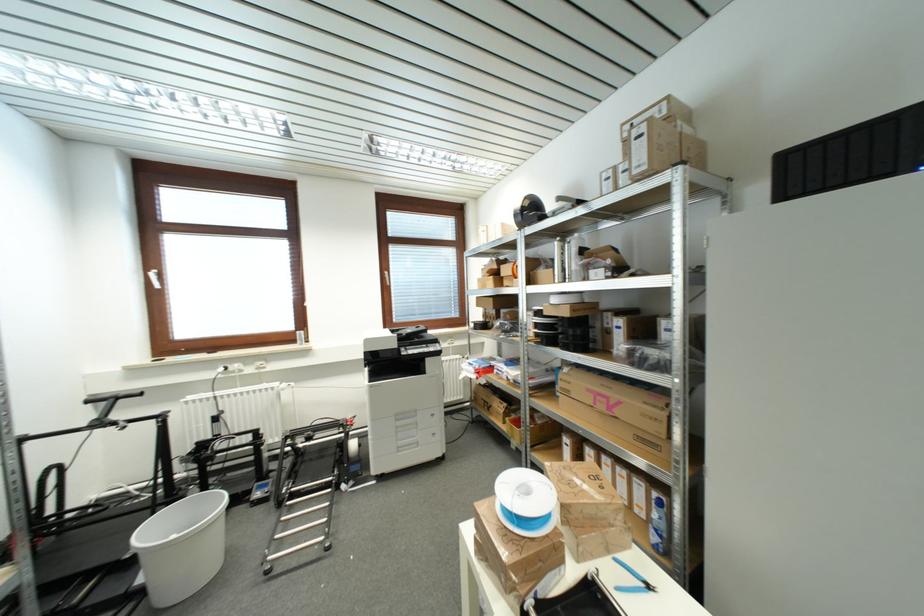
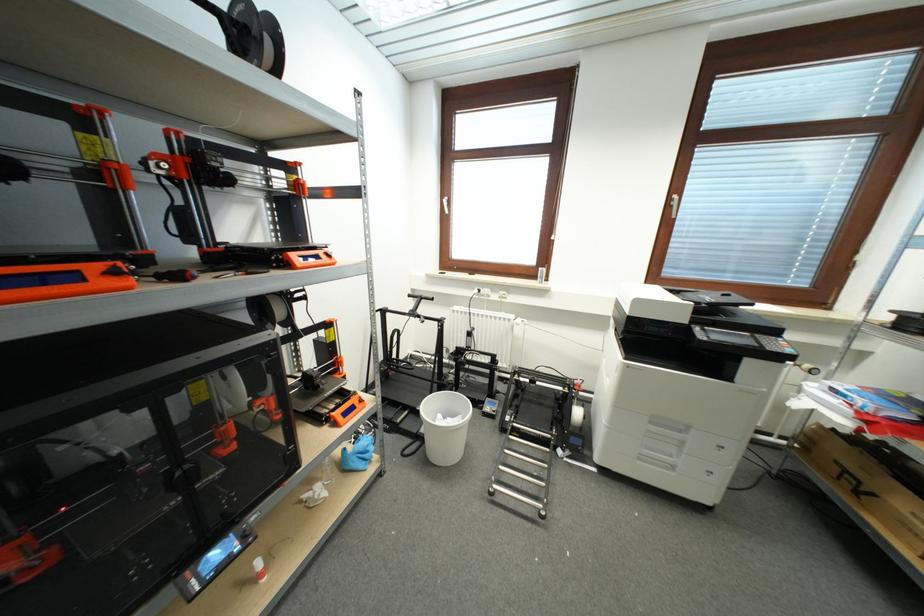
In the second image, find the point that corresponds to (x=404, y=426) in the first image.

(658, 431)